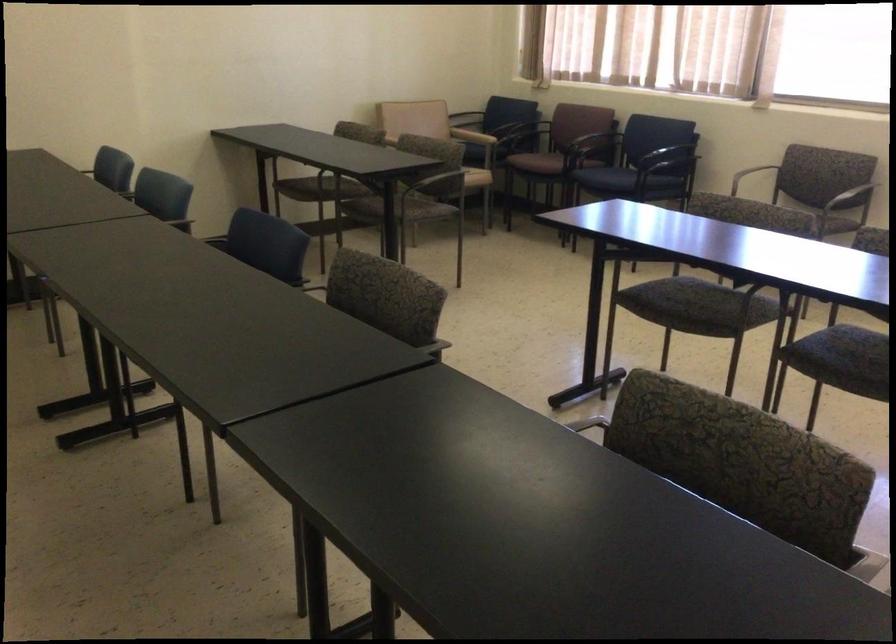
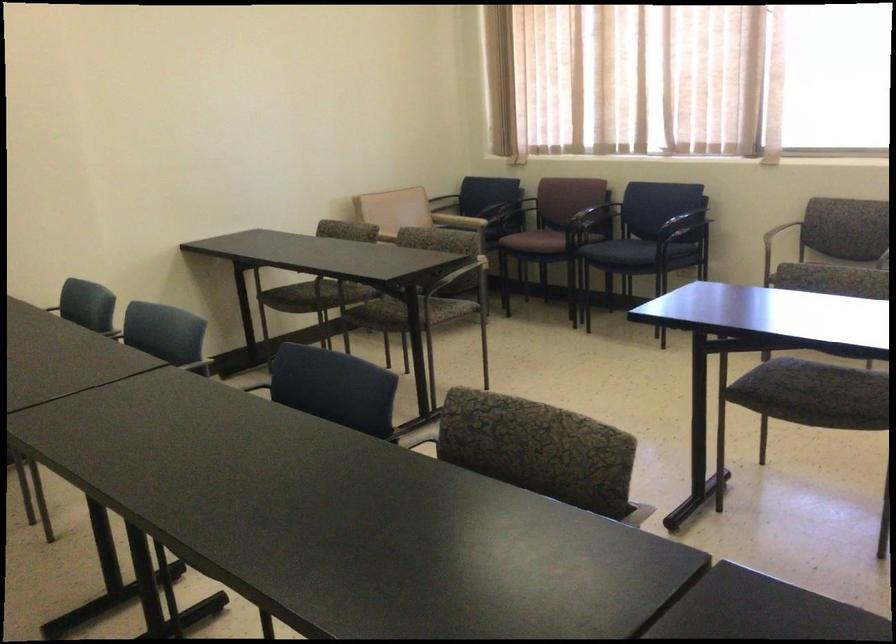
Where in the second image is the point corresponding to pixel 272 245 from the first image?

(332, 386)